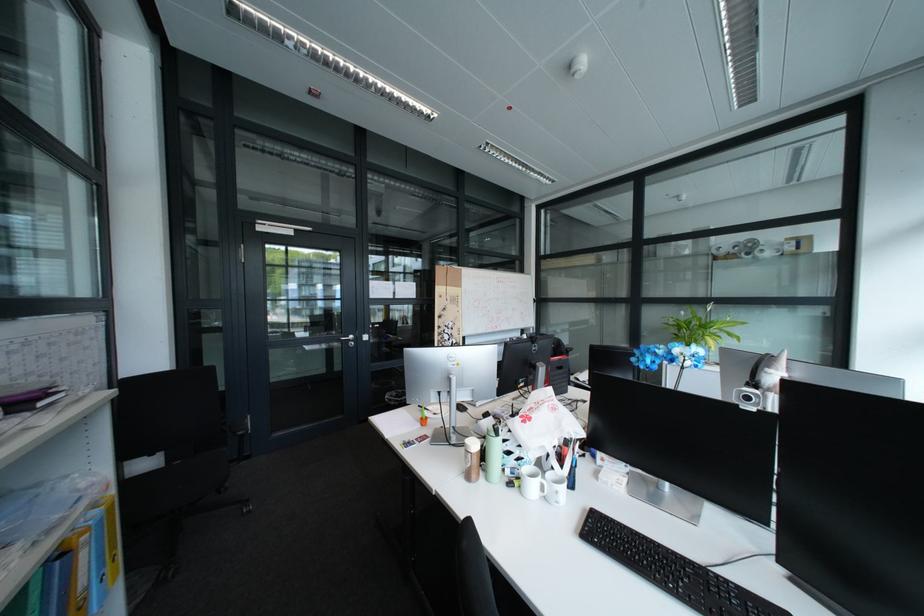
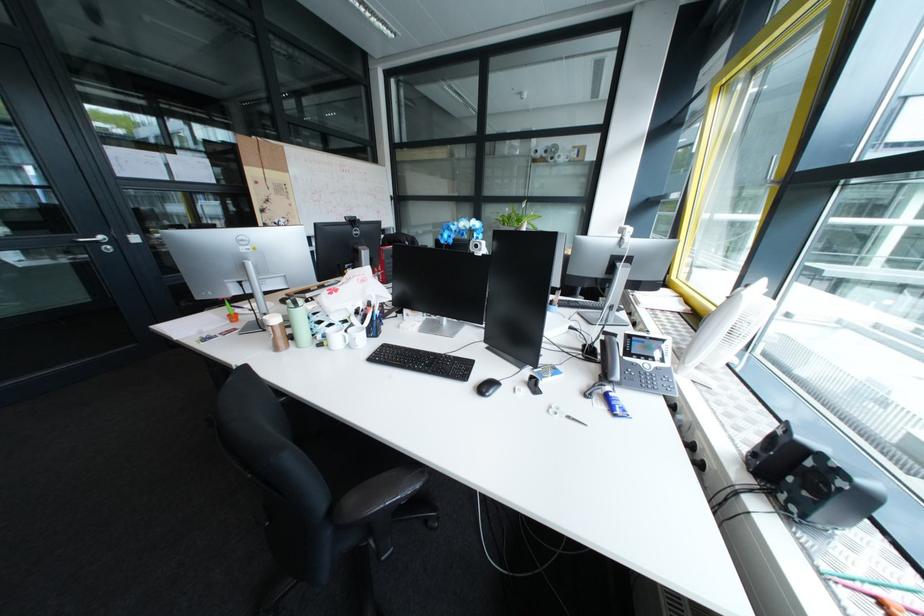
The first image is from the beginning of the video and the second image is from the end. How did the camera likely rotate when shooting the video?

The rotation direction of the camera is right-down.